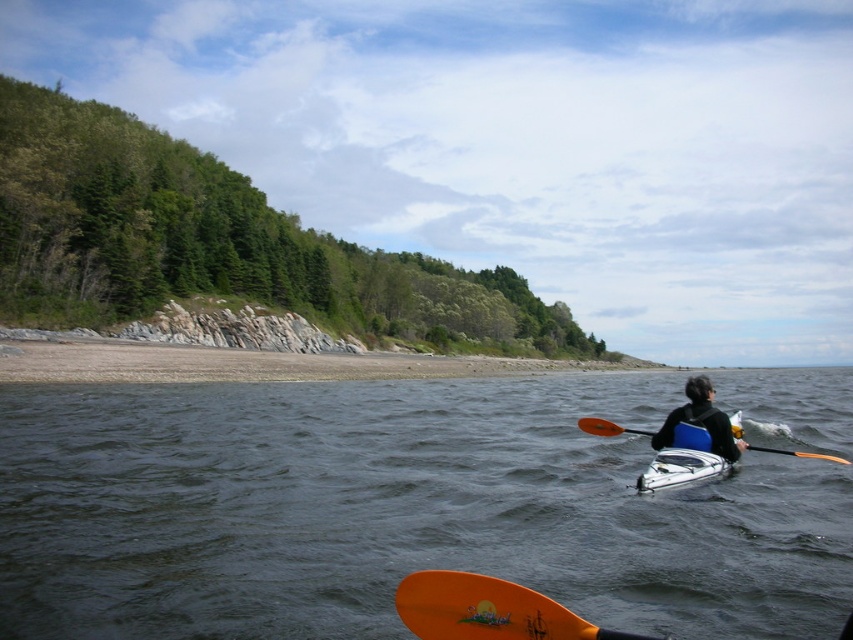
Consider the image. Which of these two, brown sand at lower left or blue plastic kayak at center, stands taller?

brown sand at lower left

Describe the element at coordinates (252, 364) in the screenshot. I see `brown sand at lower left` at that location.

The width and height of the screenshot is (853, 640). Identify the location of brown sand at lower left. (252, 364).

Where is `brown sand at lower left`? This screenshot has height=640, width=853. brown sand at lower left is located at coordinates (252, 364).

Between point (583, 628) and point (642, 481), which one is positioned in front?

Point (583, 628) is more forward.

Image resolution: width=853 pixels, height=640 pixels. I want to click on orange matte paddle at lower center, so click(486, 611).

Which is in front, point (109, 472) or point (798, 452)?

Point (109, 472) is more forward.

You are a GUI agent. You are given a task and a screenshot of the screen. Output one action in this format:
    pyautogui.click(x=<x>, y=<y>)
    Task: Click on the dark blue water at center
    This screenshot has height=640, width=853.
    Given the screenshot: What is the action you would take?
    pyautogui.click(x=393, y=509)

The height and width of the screenshot is (640, 853). Identify the location of dark blue water at center. (393, 509).

This screenshot has height=640, width=853. In order to click on dark blue water at center in this screenshot , I will do `click(393, 509)`.